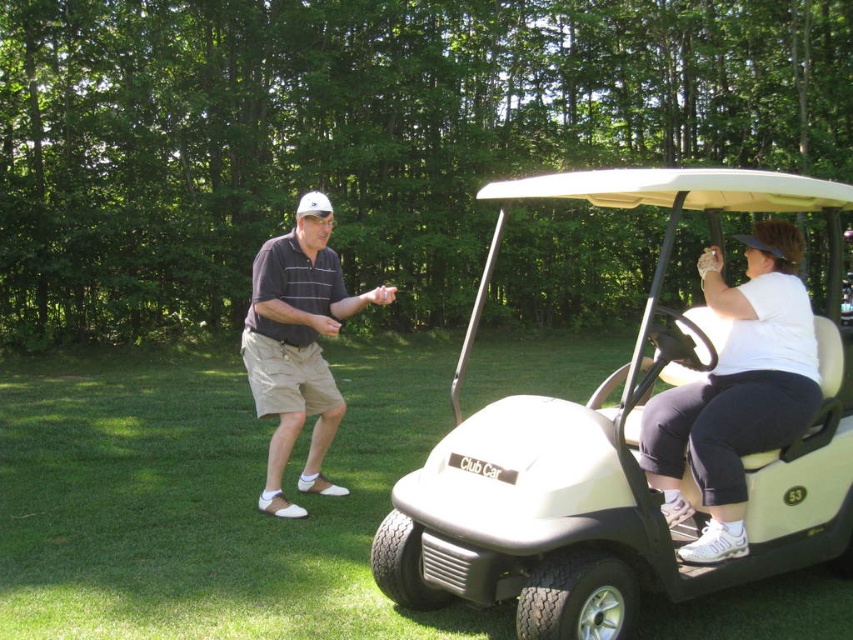
Question: Is white plastic golf cart at center further to camera compared to dark gray cotton polo shirt at center?

Choices:
 (A) no
 (B) yes

Answer: (A)

Question: Which object appears farthest from the camera in this image?

Choices:
 (A) dark gray cotton polo shirt at center
 (B) white matte golf cart at right

Answer: (A)

Question: Is white plastic golf cart at center to the left of white matte golf cart at right from the viewer's perspective?

Choices:
 (A) no
 (B) yes

Answer: (B)

Question: Is white matte golf cart at right closer to camera compared to white matte shirt at center?

Choices:
 (A) yes
 (B) no

Answer: (A)

Question: Which object is the closest to the white matte golf cart at right?

Choices:
 (A) dark gray cotton polo shirt at center
 (B) white matte shirt at center
 (C) white plastic golf cart at center

Answer: (C)

Question: Which point is farther to the camera?

Choices:
 (A) (251, 282)
 (B) (144, 401)
 (C) (646, 465)

Answer: (A)